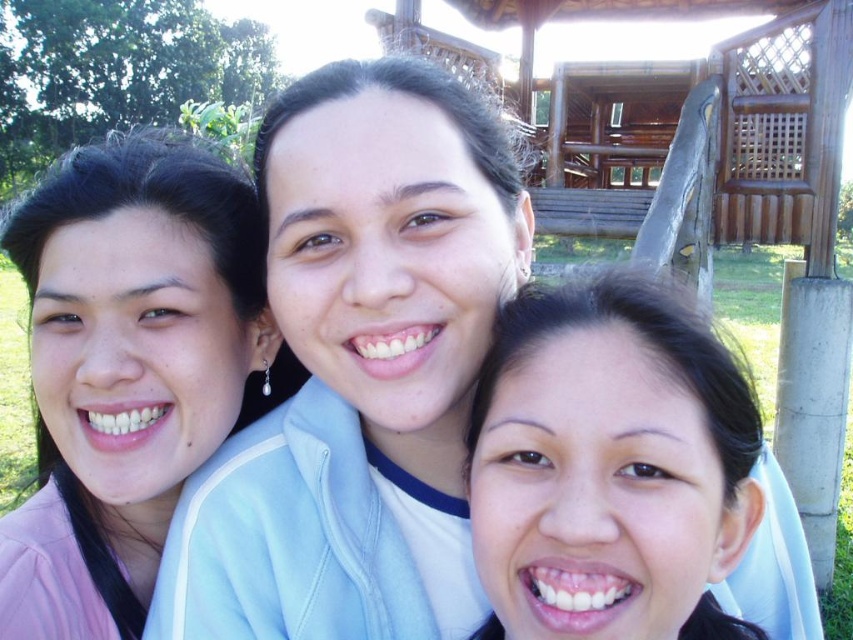
Question: Is matte pink jacket at left below smooth skin face at center?

Choices:
 (A) no
 (B) yes

Answer: (A)

Question: Does matte pink jacket at left have a greater width compared to smooth skin face at center?

Choices:
 (A) yes
 (B) no

Answer: (A)

Question: Which object appears farthest from the camera in this image?

Choices:
 (A) matte pink jacket at left
 (B) smooth skin face at center

Answer: (A)

Question: Is matte pink jacket at left closer to the viewer compared to smooth skin face at center?

Choices:
 (A) yes
 (B) no

Answer: (B)